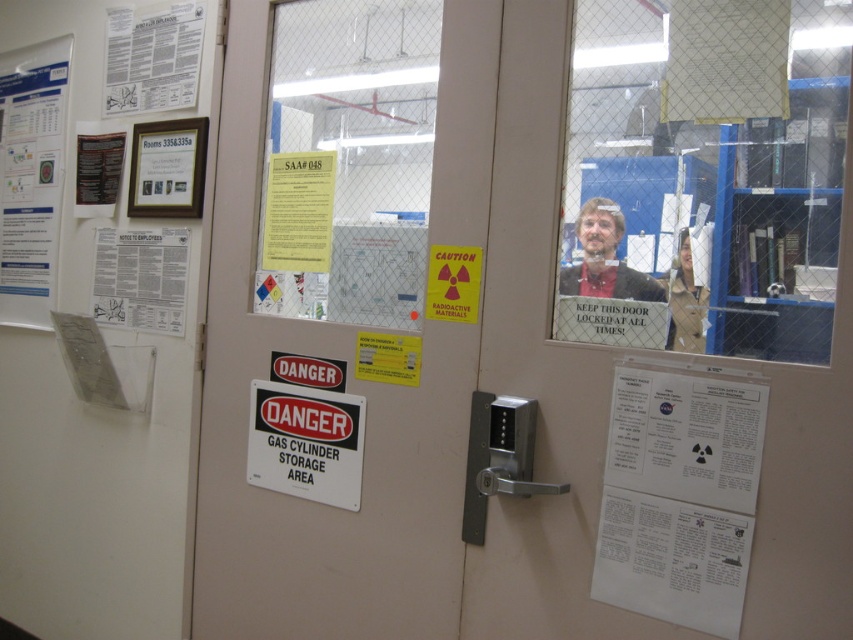
Question: Which point is farther from the camera taking this photo?

Choices:
 (A) (221, 96)
 (B) (51, 84)
 (C) (88, 173)
 (D) (722, 634)

Answer: (B)

Question: Which point is farther to the camera?

Choices:
 (A) yellow paper at upper center
 (B) white paper poster at upper left

Answer: (B)

Question: Estimate the real-world distances between objects in this image. Which object is farther from the matte black frame at upper left?

Choices:
 (A) white paper poster at upper left
 (B) matte black poster at upper left
 (C) white paper at center
 (D) white paper poster at left

Answer: (C)

Question: Is white paper at center closer to the viewer compared to white paper poster at upper left?

Choices:
 (A) yes
 (B) no

Answer: (A)

Question: Is yellow paper at upper center further to camera compared to tan leather jacket at center?

Choices:
 (A) yes
 (B) no

Answer: (A)

Question: Is clear plastic screen door at center positioned at the back of matte black poster at upper left?

Choices:
 (A) yes
 (B) no

Answer: (B)